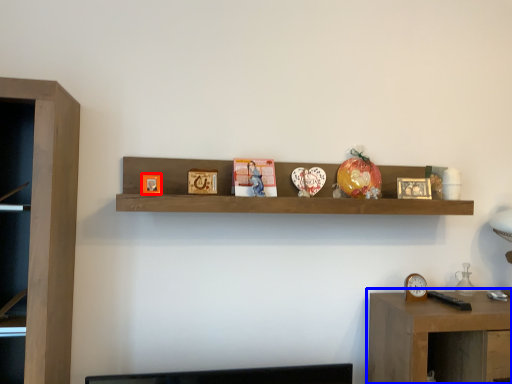
Question: Which object appears closest to the camera in this image, picture frame (highlighted by a red box) or table (highlighted by a blue box)?

Choices:
 (A) picture frame
 (B) table

Answer: (B)